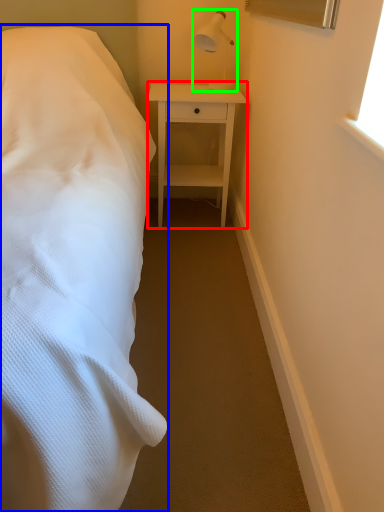
Question: Considering the real-world distances, which object is farthest from nightstand (highlighted by a red box)? bed (highlighted by a blue box) or bedside lamp (highlighted by a green box)?

Choices:
 (A) bed
 (B) bedside lamp

Answer: (A)